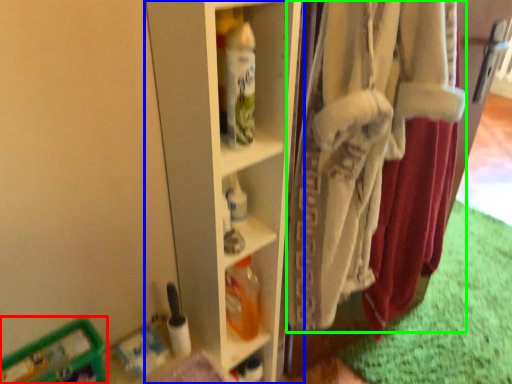
Question: Estimate the real-world distances between objects in this image. Which object is farther from wide (highlighted by a red box), shelf (highlighted by a blue box) or underclothes (highlighted by a green box)?

Choices:
 (A) shelf
 (B) underclothes

Answer: (B)